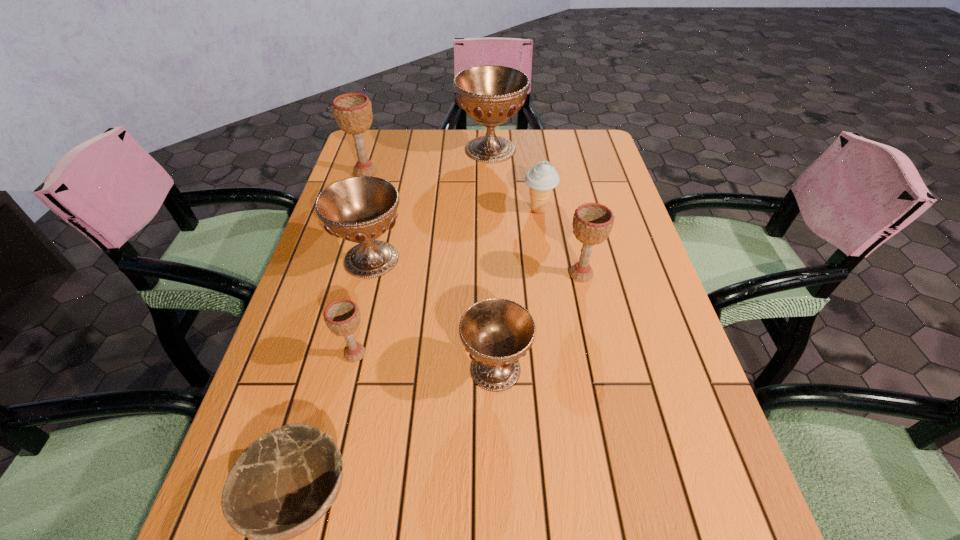
At what (x,y) coordinates should I click in order to perform the action: click on the biggest red chalice. Please return your answer as a coordinate pair (x, y). The width and height of the screenshot is (960, 540). Looking at the image, I should click on (490, 94).

Find the location of a particular element. the biggest beige chalice is located at coordinates (353, 111).

You are a GUI agent. You are given a task and a screenshot of the screen. Output one action in this format:
    pyautogui.click(x=<x>, y=<y>)
    Task: Click on the farthest beige chalice
    This screenshot has height=540, width=960.
    Given the screenshot: What is the action you would take?
    pyautogui.click(x=353, y=111)

Locate an element on the screen. the leftmost red chalice is located at coordinates (360, 209).

Where is `the second biggest red chalice`? The image size is (960, 540). the second biggest red chalice is located at coordinates (360, 209).

Where is `the rightmost chalice`? The height and width of the screenshot is (540, 960). the rightmost chalice is located at coordinates (592, 222).

Where is `the rightmost beige chalice`? the rightmost beige chalice is located at coordinates (592, 222).

Where is `the sixth nearest object`? The height and width of the screenshot is (540, 960). the sixth nearest object is located at coordinates (542, 178).

Identify the location of beige icecream. (542, 178).

Locate an element on the screen. Image resolution: width=960 pixels, height=540 pixels. the second beige chalice from right to left is located at coordinates (342, 317).